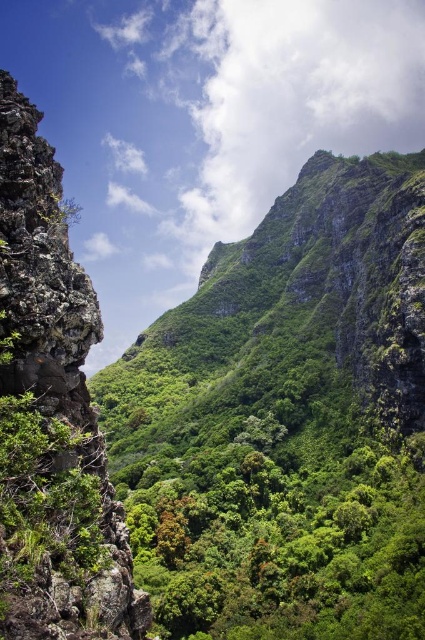
Is rough textured rock at left smaller than green leafy tree at center?

Incorrect, rough textured rock at left is not smaller in size than green leafy tree at center.

In order to click on rough textured rock at left in this screenshot , I will do `click(56, 369)`.